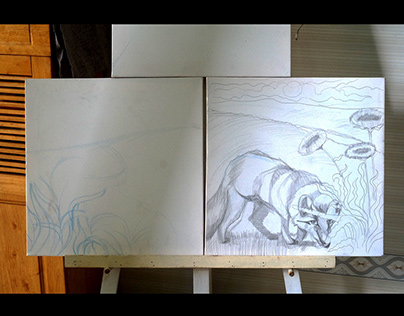
At what (x,y) coordinates should I click in order to perform the action: click on easel. Please return your answer as a coordinate pair (x, y). Looking at the image, I should click on (282, 184), (104, 171), (105, 286), (197, 276), (212, 285), (295, 283), (206, 259).